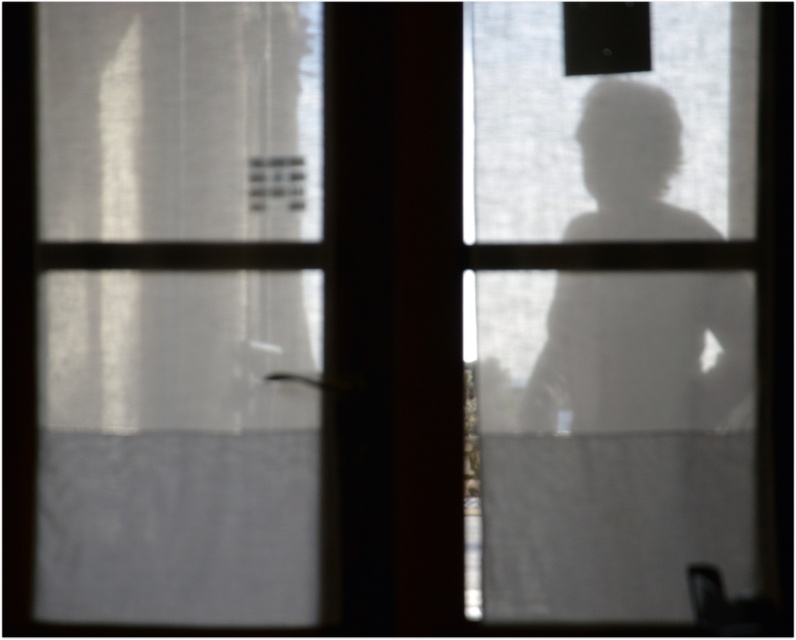
Can you confirm if satin white curtain at left is positioned above transparent glass figure at right?

No.

Is satin white curtain at left taller than transparent glass figure at right?

Indeed, satin white curtain at left has a greater height compared to transparent glass figure at right.

Between point (92, 506) and point (644, 61), which one is positioned in front?

Point (644, 61) is more forward.

The height and width of the screenshot is (640, 796). Identify the location of satin white curtain at left. (178, 310).